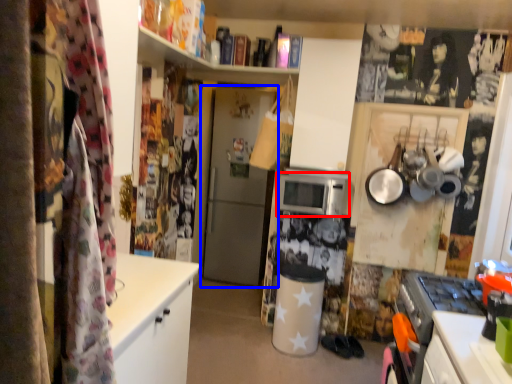
Question: Which point is closer to the camera, microwave oven (highlighted by a red box) or door (highlighted by a blue box)?

Choices:
 (A) microwave oven
 (B) door

Answer: (A)